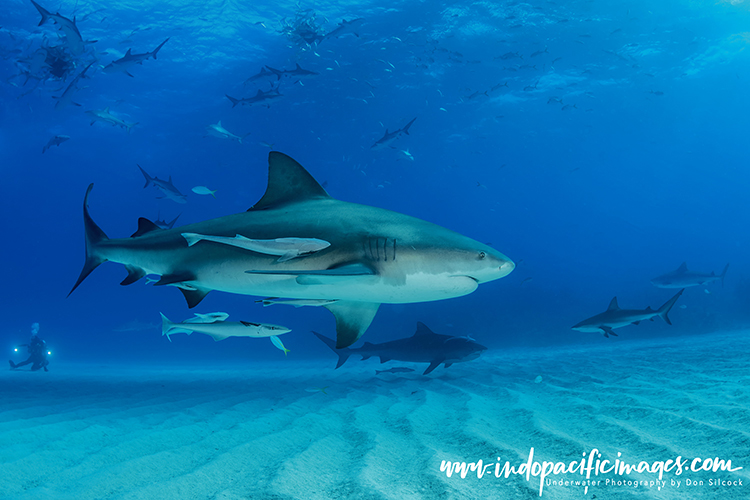
The height and width of the screenshot is (500, 750). Identify the location of light. (16, 347).